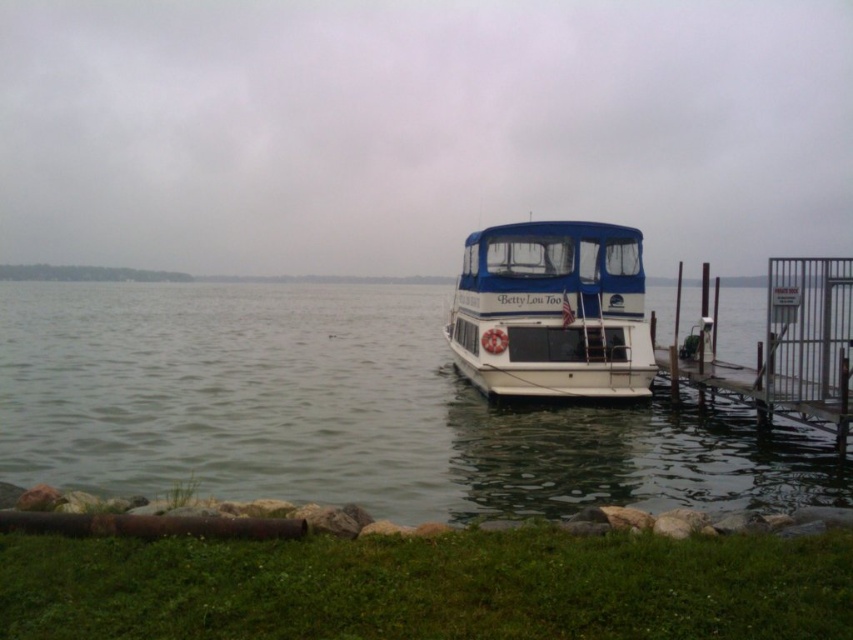
You are standing on the metallic gray dock at lower right and want to board the white glossy houseboat at center. Which direction should you face to see the houseboat?

You should face to the left to see the white glossy houseboat at center since it is located to the left of the metallic gray dock at lower right.